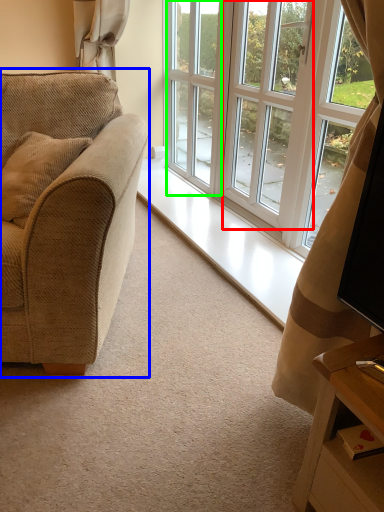
Question: Based on their relative distances, which object is farther from screen door (highlighted by a red box)? Choose from studio couch (highlighted by a blue box) and screen door (highlighted by a green box).

Choices:
 (A) studio couch
 (B) screen door

Answer: (A)